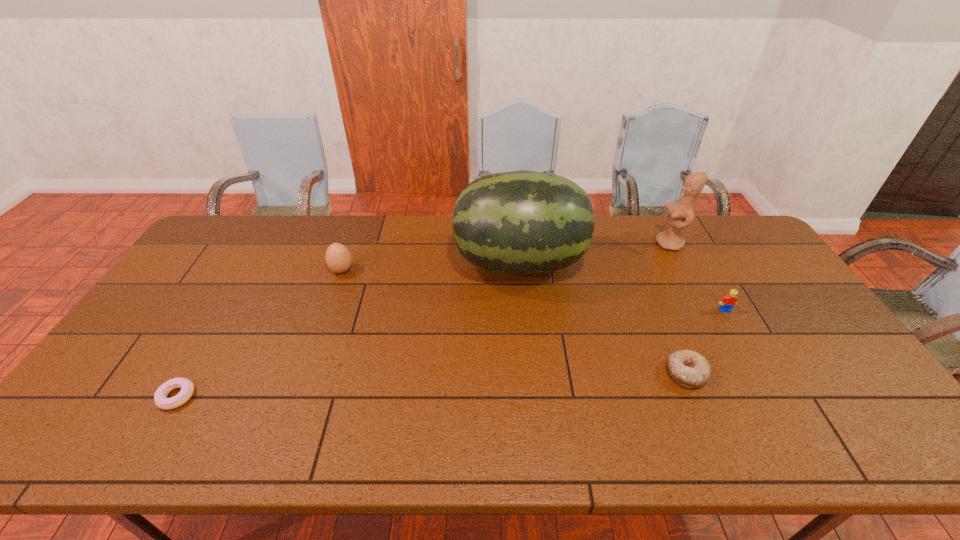
Where is `watermelon`? watermelon is located at coordinates (522, 222).

The image size is (960, 540). In order to click on figurine in this screenshot , I will do [x=680, y=213].

The width and height of the screenshot is (960, 540). I want to click on the fifth object from right to left, so click(338, 258).

Where is `boiled egg`? boiled egg is located at coordinates (338, 258).

This screenshot has height=540, width=960. What are the coordinates of `Lego` in the screenshot? It's located at (727, 302).

You are a GUI agent. You are given a task and a screenshot of the screen. Output one action in this format:
    pyautogui.click(x=<x>, y=<y>)
    Task: Click on the third nearest object
    
    Given the screenshot: What is the action you would take?
    pyautogui.click(x=727, y=302)

In order to click on the fourth object from left to right in this screenshot , I will do `click(688, 368)`.

Image resolution: width=960 pixels, height=540 pixels. Identify the location of the right doughnut. (688, 368).

You are a GUI agent. You are given a task and a screenshot of the screen. Output one action in this format:
    pyautogui.click(x=<x>, y=<y>)
    Task: Click on the shorter doughnut
    
    Given the screenshot: What is the action you would take?
    pyautogui.click(x=160, y=396)

Find the location of a particular element. The height and width of the screenshot is (540, 960). the leftmost object is located at coordinates (160, 396).